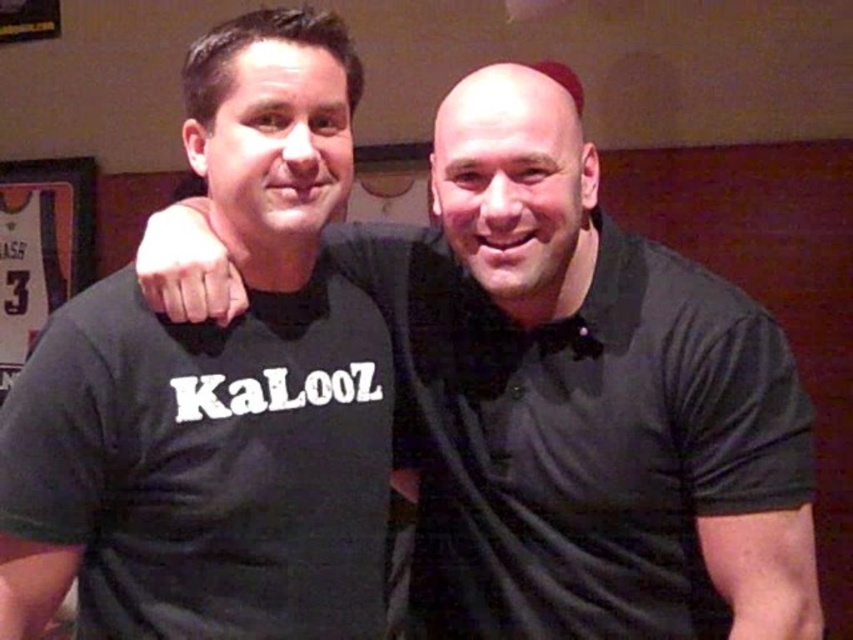
Does black matte shirt at center have a lesser width compared to black cotton polo shirt at right?

No.

Between black matte shirt at center and black cotton polo shirt at right, which one has more height?

black matte shirt at center

Locate an element on the screen. Image resolution: width=853 pixels, height=640 pixels. black matte shirt at center is located at coordinates (590, 404).

The height and width of the screenshot is (640, 853). I want to click on black matte shirt at center, so click(590, 404).

Between black matte t-shirt at left and black cotton polo shirt at right, which one has more height?

black matte t-shirt at left

Can you confirm if black matte t-shirt at left is positioned below black cotton polo shirt at right?

No.

Identify the location of black matte t-shirt at left. (218, 392).

The width and height of the screenshot is (853, 640). In order to click on black matte t-shirt at left in this screenshot , I will do `click(218, 392)`.

Who is taller, black matte shirt at center or black matte t-shirt at left?

Standing taller between the two is black matte t-shirt at left.

Does black matte shirt at center appear over black matte t-shirt at left?

Correct, black matte shirt at center is located above black matte t-shirt at left.

Describe the element at coordinates (590, 404) in the screenshot. The height and width of the screenshot is (640, 853). I see `black matte shirt at center` at that location.

Identify the location of black matte shirt at center. (590, 404).